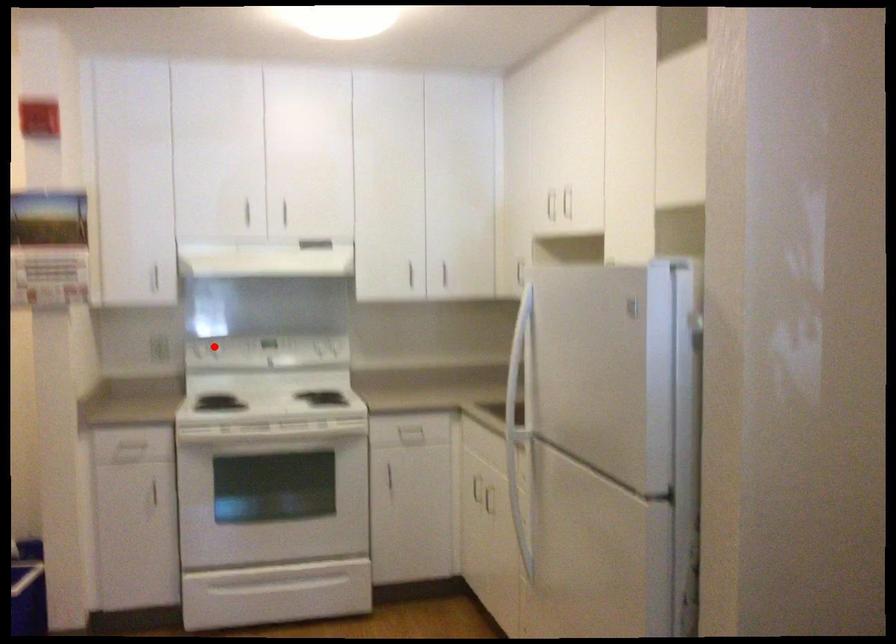
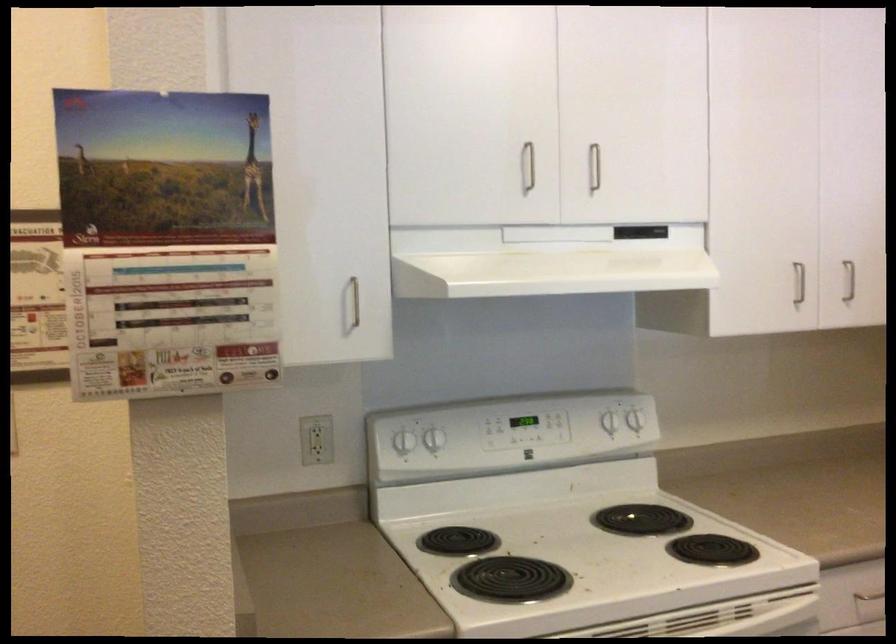
Where in the second image is the point corresponding to the highlighted location from the first image?

(435, 439)